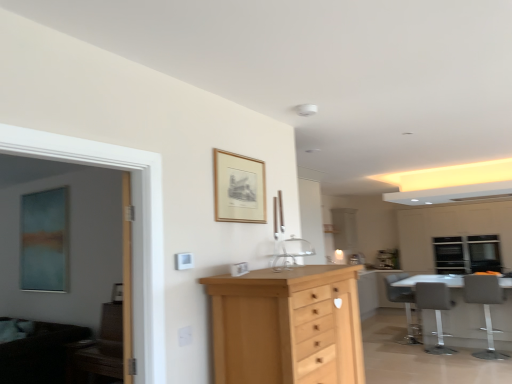
Question: From the image's perspective, would you say white glossy table at lower right is positioned over wooden picture frame at upper center?

Choices:
 (A) no
 (B) yes

Answer: (A)

Question: From a real-world perspective, is white glossy table at lower right located higher than wooden picture frame at upper center?

Choices:
 (A) yes
 (B) no

Answer: (B)

Question: From the image's perspective, would you say white glossy table at lower right is shown under wooden picture frame at upper center?

Choices:
 (A) yes
 (B) no

Answer: (A)

Question: Is white glossy table at lower right to the left of wooden picture frame at upper center from the viewer's perspective?

Choices:
 (A) yes
 (B) no

Answer: (B)

Question: Is the depth of white glossy table at lower right greater than that of wooden picture frame at upper center?

Choices:
 (A) yes
 (B) no

Answer: (A)

Question: Is white glossy table at lower right in front of wooden picture frame at upper center?

Choices:
 (A) yes
 (B) no

Answer: (B)

Question: Can you confirm if matte gray chair at lower right, placed as the 2th chair when sorted from back to front, is positioned to the left of white glossy cabinetry at right?

Choices:
 (A) no
 (B) yes

Answer: (B)

Question: Is matte gray chair at lower right, arranged as the 2th chair when viewed from the front, facing away from white glossy cabinetry at right?

Choices:
 (A) no
 (B) yes

Answer: (A)

Question: From a real-world perspective, is matte gray chair at lower right, placed as the 2th chair when sorted from back to front, located beneath white glossy cabinetry at right?

Choices:
 (A) no
 (B) yes

Answer: (B)

Question: Does matte gray chair at lower right, arranged as the 2th chair when viewed from the front, have a greater height compared to white glossy cabinetry at right?

Choices:
 (A) no
 (B) yes

Answer: (A)

Question: From a real-world perspective, does matte gray chair at lower right, placed as the 2th chair when sorted from back to front, stand above white glossy cabinetry at right?

Choices:
 (A) yes
 (B) no

Answer: (B)

Question: Is matte gray chair at lower right, arranged as the 2th chair when viewed from the front, wider than white glossy cabinetry at right?

Choices:
 (A) yes
 (B) no

Answer: (B)

Question: Is transparent glass window at upper right outside matte gray chair at lower right, arranged as the 2th chair when viewed from the front?

Choices:
 (A) no
 (B) yes

Answer: (B)